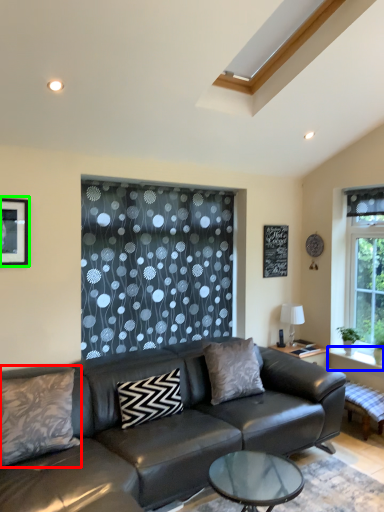
Question: Based on their relative distances, which object is nearer to pillow (highlighted by a red box)? Choose from window sill (highlighted by a blue box) and picture frame (highlighted by a green box).

Choices:
 (A) window sill
 (B) picture frame

Answer: (B)